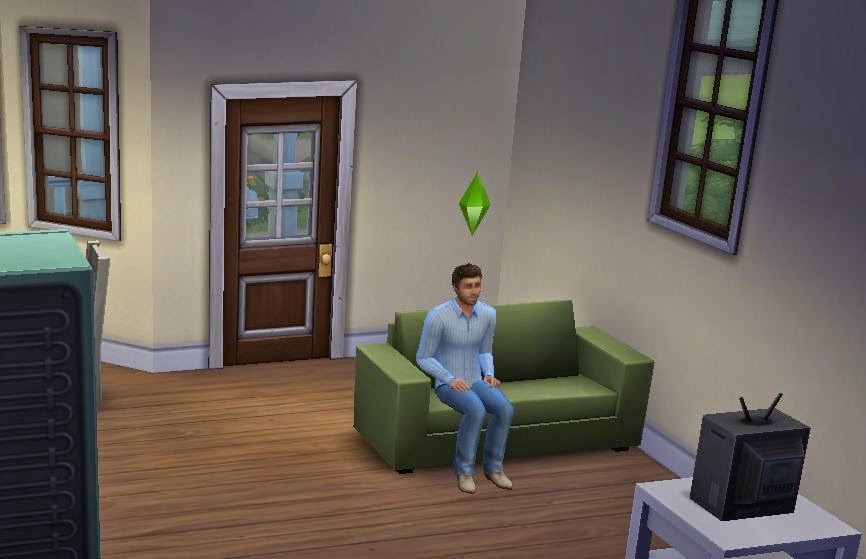
Find the location of a particular element. Image resolution: width=866 pixels, height=559 pixels. tv stand is located at coordinates (724, 539).